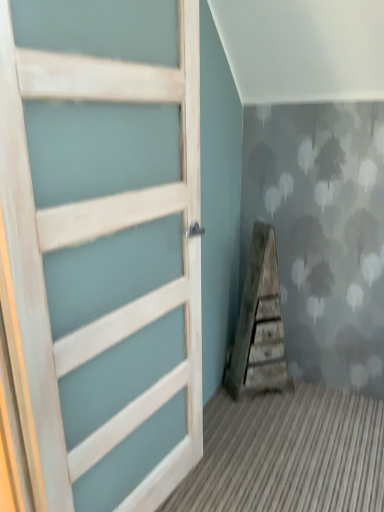
Question: Can we say weathered wood staircase at center lies outside white wood door at left?

Choices:
 (A) yes
 (B) no

Answer: (A)

Question: Is weathered wood staircase at center bigger than white wood door at left?

Choices:
 (A) yes
 (B) no

Answer: (B)

Question: Does weathered wood staircase at center have a lesser width compared to white wood door at left?

Choices:
 (A) no
 (B) yes

Answer: (A)

Question: From the image's perspective, does weathered wood staircase at center appear lower than white wood door at left?

Choices:
 (A) no
 (B) yes

Answer: (B)

Question: Is the position of weathered wood staircase at center less distant than that of white wood door at left?

Choices:
 (A) no
 (B) yes

Answer: (A)

Question: Does weathered wood staircase at center contain white wood door at left?

Choices:
 (A) no
 (B) yes

Answer: (A)

Question: Is white wood door at left positioned in front of weathered wood staircase at center?

Choices:
 (A) yes
 (B) no

Answer: (A)

Question: Does white wood door at left appear on the left side of weathered wood staircase at center?

Choices:
 (A) yes
 (B) no

Answer: (A)

Question: Is white wood door at left turned away from weathered wood staircase at center?

Choices:
 (A) no
 (B) yes

Answer: (A)

Question: From a real-world perspective, is white wood door at left positioned over weathered wood staircase at center based on gravity?

Choices:
 (A) no
 (B) yes

Answer: (B)

Question: From the image's perspective, is white wood door at left on top of weathered wood staircase at center?

Choices:
 (A) no
 (B) yes

Answer: (B)

Question: From a real-world perspective, does white wood door at left sit lower than weathered wood staircase at center?

Choices:
 (A) yes
 (B) no

Answer: (B)

Question: From the image's perspective, is weathered wood staircase at center located above or below white wood door at left?

Choices:
 (A) below
 (B) above

Answer: (A)